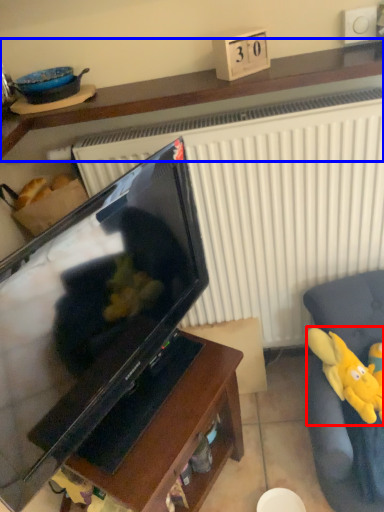
Question: Which object is further to the camera taking this photo, toy (highlighted by a red box) or furniture (highlighted by a blue box)?

Choices:
 (A) toy
 (B) furniture

Answer: (A)